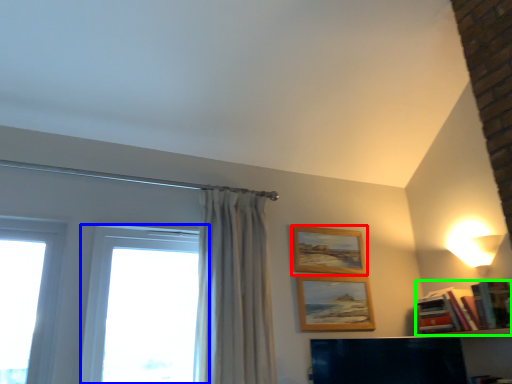
Question: Which is farther away from picture frame (highlighted by a red box)? window (highlighted by a blue box) or book (highlighted by a green box)?

Choices:
 (A) window
 (B) book

Answer: (A)